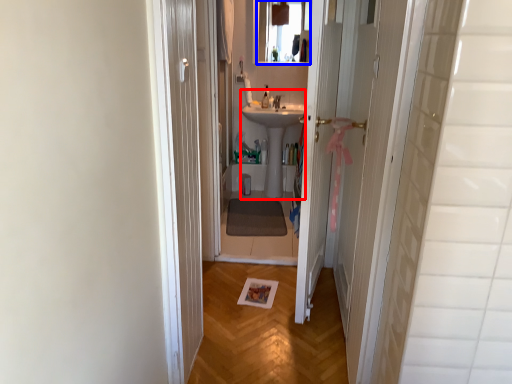
Question: Which of the following is the farthest to the observer, sink (highlighted by a red box) or mirror (highlighted by a blue box)?

Choices:
 (A) sink
 (B) mirror

Answer: (B)